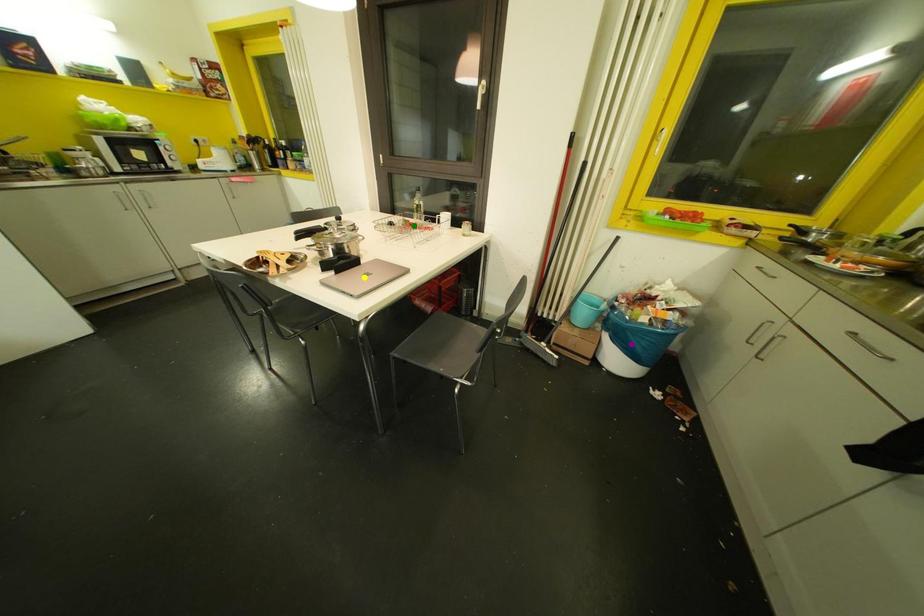
Order these from nearest to farthest:
yellow point, green point, purple point

yellow point
purple point
green point